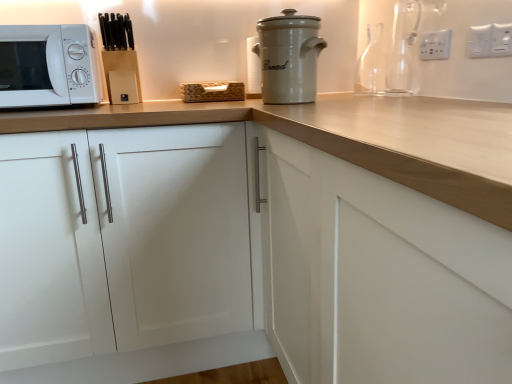
Locate an element on the screen. Image resolution: width=512 pixels, height=384 pixels. white ceramic bread bin at upper center is located at coordinates (289, 57).

What do you see at coordinates (289, 57) in the screenshot? I see `white ceramic bread bin at upper center` at bounding box center [289, 57].

Where is `white plastic electric outlet at upper right, placed as the second electric outlet when sorted from front to back`? white plastic electric outlet at upper right, placed as the second electric outlet when sorted from front to back is located at coordinates (479, 41).

Find the location of a particular element. transparent glass carafe at upper right, the second bottle from the back is located at coordinates (403, 47).

This screenshot has height=384, width=512. Identify the location of white plastic electric outlet at upper right, the 3th electric outlet when ordered from right to left. (435, 45).

Is white matte microwave at left not within white plastic electric outlet at upper right, the 3th electric outlet when ordered from right to left?

That's correct, white matte microwave at left is outside of white plastic electric outlet at upper right, the 3th electric outlet when ordered from right to left.

Considering the relative sizes of white matte microwave at left and white plastic electric outlet at upper right, the 3th electric outlet from the front, in the image provided, is white matte microwave at left shorter than white plastic electric outlet at upper right, the 3th electric outlet from the front,?

Incorrect, the height of white matte microwave at left does not fall short of that of white plastic electric outlet at upper right, the 3th electric outlet from the front.

Locate an element on the screen. This screenshot has width=512, height=384. microwave oven in front of the white plastic electric outlet at upper right, the 3th electric outlet when ordered from right to left is located at coordinates (48, 66).

Is white matte microwave at left facing away from white plastic electric outlet at upper right, which is the first electric outlet in back-to-front order?

No, white matte microwave at left is not facing the opposite direction of white plastic electric outlet at upper right, which is the first electric outlet in back-to-front order.

Is white matte microwave at left with white matte cabinet at center?

No, white matte microwave at left is not beside white matte cabinet at center.

From the image's perspective, is white matte microwave at left located above white matte cabinet at center?

Yes, from the image's perspective, white matte microwave at left is above white matte cabinet at center.

Is white matte microwave at left oriented towards white matte cabinet at center?

No, white matte microwave at left is not aimed at white matte cabinet at center.

Locate an element on the screen. This screenshot has width=512, height=384. microwave oven that appears above the white matte cabinet at center (from a real-world perspective) is located at coordinates (48, 66).

Is transparent glass bottle at upper right, the 2th bottle from the front, not within white matte cabinet at center?

Indeed, transparent glass bottle at upper right, the 2th bottle from the front, is completely outside white matte cabinet at center.

Is transparent glass bottle at upper right, which appears as the first bottle when viewed from the back, behind white matte cabinet at center?

Yes, the depth of transparent glass bottle at upper right, which appears as the first bottle when viewed from the back, is greater than that of white matte cabinet at center.

From the picture: From the image's perspective, is transparent glass bottle at upper right, which appears as the first bottle when viewed from the back, located beneath white matte cabinet at center?

No.

The image size is (512, 384). What are the coordinates of `bottle to the right of transparent glass bottle at upper right, which appears as the first bottle when viewed from the back` in the screenshot? It's located at (403, 47).

Is the depth of transparent glass bottle at upper right, which appears as the first bottle when viewed from the back, greater than that of transparent glass carafe at upper right, the second bottle from the back?

Yes, transparent glass bottle at upper right, which appears as the first bottle when viewed from the back, is further from the camera.

Is transparent glass bottle at upper right, which appears as the first bottle when viewed from the back, directly adjacent to transparent glass carafe at upper right, arranged as the first bottle when viewed from the front?

No, transparent glass bottle at upper right, which appears as the first bottle when viewed from the back, is not in contact with transparent glass carafe at upper right, arranged as the first bottle when viewed from the front.

Can you tell me how much transparent glass bottle at upper right, the 2th bottle from the front, and transparent glass carafe at upper right, the second bottle from the back, differ in facing direction?

The facing directions of transparent glass bottle at upper right, the 2th bottle from the front, and transparent glass carafe at upper right, the second bottle from the back, are 0.000388 degrees apart.

From the picture: How different are the orientations of white matte microwave at left and transparent glass bottle at upper right, the 2th bottle from the front, in degrees?

The angle between the facing direction of white matte microwave at left and the facing direction of transparent glass bottle at upper right, the 2th bottle from the front, is 88.9 degrees.

Relative to transparent glass bottle at upper right, the 2th bottle from the front, is white matte microwave at left in front or behind?

In the image, white matte microwave at left appears in front of transparent glass bottle at upper right, the 2th bottle from the front.

Does point (24, 48) come farther from viewer compared to point (371, 44)?

No.

Is transparent glass bottle at upper right, which appears as the first bottle when viewed from the back, at the back of white matte microwave at left?

No, white matte microwave at left is not facing away from transparent glass bottle at upper right, which appears as the first bottle when viewed from the back.

From a real-world perspective, is white plastic electric outlet at upper right, which is the first electric outlet in left-to-right order, beneath white plastic electric outlet at upper right, which ranks as the 2th electric outlet in right-to-left order?

Incorrect, from a real-world perspective, white plastic electric outlet at upper right, which is the first electric outlet in left-to-right order, is higher than white plastic electric outlet at upper right, which ranks as the 2th electric outlet in right-to-left order.

Is white plastic electric outlet at upper right, the 3th electric outlet from the front, smaller than white plastic electric outlet at upper right, the 2th electric outlet when ordered from left to right?

Actually, white plastic electric outlet at upper right, the 3th electric outlet from the front, might be larger than white plastic electric outlet at upper right, the 2th electric outlet when ordered from left to right.

Between white plastic electric outlet at upper right, the 3th electric outlet from the front, and white plastic electric outlet at upper right, the 2th electric outlet when ordered from left to right, which one is positioned behind?

white plastic electric outlet at upper right, the 3th electric outlet from the front, is behind.

Could you tell me if white plastic electric outlet at upper right, which is the first electric outlet in back-to-front order, is turned towards white plastic electric outlet at upper right, which is counted as the second electric outlet, starting from the back?

No, white plastic electric outlet at upper right, which is the first electric outlet in back-to-front order, is not turned towards white plastic electric outlet at upper right, which is counted as the second electric outlet, starting from the back.

Which is correct: white plastic electric outlet at upper right, the 2th electric outlet when ordered from left to right, is inside white matte cabinet at center, or outside of it?

white plastic electric outlet at upper right, the 2th electric outlet when ordered from left to right, is spatially situated outside white matte cabinet at center.

Based on the photo, is white plastic electric outlet at upper right, which is counted as the second electric outlet, starting from the back, facing away from white matte cabinet at center?

white plastic electric outlet at upper right, which is counted as the second electric outlet, starting from the back, does not have its back to white matte cabinet at center.

Between point (479, 47) and point (84, 269), which one is positioned behind?

The point (84, 269) is behind.

From the image's perspective, which object appears higher, white plastic electric outlet at upper right, which ranks as the 2th electric outlet in right-to-left order, or white matte cabinet at center?

white plastic electric outlet at upper right, which ranks as the 2th electric outlet in right-to-left order, appears higher in the image.

Find the location of a particular element. The image size is (512, 384). microwave oven that appears below the white plastic electric outlet at upper right, the 3th electric outlet from the front (from a real-world perspective) is located at coordinates (48, 66).

The height and width of the screenshot is (384, 512). Find the location of `microwave oven above the white matte cabinet at center (from a real-world perspective)`. microwave oven above the white matte cabinet at center (from a real-world perspective) is located at coordinates (48, 66).

Based on their spatial positions, is white plastic electric outlet at upper right, which is counted as the second electric outlet, starting from the back, or transparent glass carafe at upper right, the second bottle from the back, further from white ceramic bread bin at upper center?

The object further to white ceramic bread bin at upper center is white plastic electric outlet at upper right, which is counted as the second electric outlet, starting from the back.

From the image, which object appears to be farther from white matte cabinet at center, transparent glass bottle at upper right, the 2th bottle from the front, or transparent glass carafe at upper right, the second bottle from the back?

transparent glass bottle at upper right, the 2th bottle from the front, is further to white matte cabinet at center.

Based on their spatial positions, is transparent glass bottle at upper right, which appears as the first bottle when viewed from the back, or white plastic electric outlet at upper right, which is the first electric outlet in left-to-right order, closer to white plastic electric outlet at upper right, which is counted as the second electric outlet, starting from the back?

Based on the image, white plastic electric outlet at upper right, which is the first electric outlet in left-to-right order, appears to be nearer to white plastic electric outlet at upper right, which is counted as the second electric outlet, starting from the back.

Based on their spatial positions, is white plastic electric outlet at upper right, which is counted as the second electric outlet, starting from the back, or transparent glass carafe at upper right, arranged as the first bottle when viewed from the front, further from white matte microwave at left?

Based on the image, white plastic electric outlet at upper right, which is counted as the second electric outlet, starting from the back, appears to be further to white matte microwave at left.

Based on their spatial positions, is white plastic electric outlet at upper right, the 3th electric outlet when ordered from right to left, or transparent glass bottle at upper right, the 2th bottle from the front, further from white matte cabinet at center?

white plastic electric outlet at upper right, the 3th electric outlet when ordered from right to left.

Based on their spatial positions, is white plastic electric outlet at upper right, the 3th electric outlet from the front, or white plastic electric outlet at upper right, which is counted as the second electric outlet, starting from the back, further from white ceramic bread bin at upper center?

Based on the image, white plastic electric outlet at upper right, which is counted as the second electric outlet, starting from the back, appears to be further to white ceramic bread bin at upper center.

From the image, which object appears to be nearer to white plastic electric outlet at upper right, which is counted as the second electric outlet, starting from the back, white plastic electric outlet at upper right, the 3th electric outlet from the front, or transparent glass bottle at upper right, the 2th bottle from the front?

white plastic electric outlet at upper right, the 3th electric outlet from the front, lies closer to white plastic electric outlet at upper right, which is counted as the second electric outlet, starting from the back, than the other object.

Looking at the image, which one is located closer to white matte microwave at left, white ceramic bread bin at upper center or white plastic electric outlet at upper right, acting as the third electric outlet starting from the back?

Based on the image, white ceramic bread bin at upper center appears to be nearer to white matte microwave at left.

The image size is (512, 384). In order to click on home appliance situated between white matte microwave at left and transparent glass carafe at upper right, arranged as the first bottle when viewed from the front, from left to right in this screenshot , I will do `click(289, 57)`.

Find the location of a particular element. bottle between white plastic electric outlet at upper right, acting as the third electric outlet starting from the back, and transparent glass bottle at upper right, the 2th bottle from the front, along the z-axis is located at coordinates (403, 47).

At what (x,y) coordinates should I click in order to perform the action: click on cabinetry between white matte microwave at left and white plastic electric outlet at upper right, the third electric outlet in the left-to-right sequence. Please return your answer as a coordinate pair (x, y). Looking at the image, I should click on coord(125,242).

Locate an element on the screen. This screenshot has height=384, width=512. electric outlet between white plastic electric outlet at upper right, which ranks as the 2th electric outlet in right-to-left order, and transparent glass bottle at upper right, which appears as the first bottle when viewed from the back, from front to back is located at coordinates (435, 45).